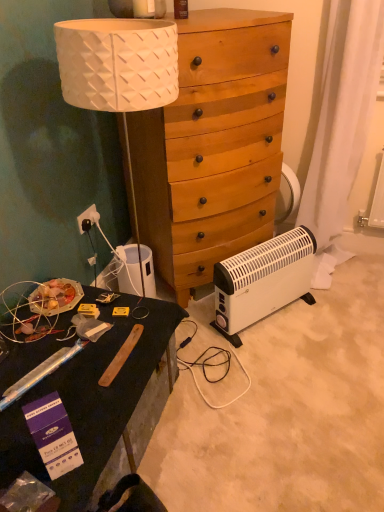
Describe the element at coordinates (85, 217) in the screenshot. This screenshot has width=384, height=512. I see `white plastic power outlet at lower left` at that location.

The height and width of the screenshot is (512, 384). What do you see at coordinates (262, 280) in the screenshot?
I see `white plastic radiator at lower right` at bounding box center [262, 280].

In order to face translucent plastic bottle at upper center, should I rotate leftwards or rightwards?

It's best to rotate left around 1.697 degrees.

Identify the location of white plastic power outlet at lower left. This screenshot has height=512, width=384. (85, 217).

Does point (181, 17) come behind point (82, 219)?

No, it is in front of (82, 219).

Is translucent plastic bottle at upper center smaller than white plastic power outlet at lower left?

Indeed, translucent plastic bottle at upper center has a smaller size compared to white plastic power outlet at lower left.

Is translucent plastic bottle at upper center spatially inside white plastic power outlet at lower left, or outside of it?

translucent plastic bottle at upper center lies outside white plastic power outlet at lower left.

Image resolution: width=384 pixels, height=512 pixels. I want to click on desk in front of the white plastic radiator at lower right, so click(92, 400).

Relative to black matte desk at lower left, is white plastic radiator at lower right in front or behind?

white plastic radiator at lower right is positioned farther from the viewer than black matte desk at lower left.

Considering the sizes of objects white plastic radiator at lower right and black matte desk at lower left in the image provided, who is wider, white plastic radiator at lower right or black matte desk at lower left?

Wider between the two is black matte desk at lower left.

Is point (230, 307) closer to viewer compared to point (59, 373)?

No.

Considering the relative sizes of white plastic power outlet at lower left and wooden dresser at center in the image provided, is white plastic power outlet at lower left smaller than wooden dresser at center?

Indeed, white plastic power outlet at lower left has a smaller size compared to wooden dresser at center.

Is wooden dresser at center located within white plastic power outlet at lower left?

No, white plastic power outlet at lower left does not contain wooden dresser at center.

Find the location of `dresser above the white plastic power outlet at lower left (from a real-world perspective)`. dresser above the white plastic power outlet at lower left (from a real-world perspective) is located at coordinates (213, 145).

Is white plastic power outlet at lower left at the back of black matte desk at lower left?

That's not correct — black matte desk at lower left is not looking away from white plastic power outlet at lower left.

Image resolution: width=384 pixels, height=512 pixels. Find the location of `power outlet behind the black matte desk at lower left`. power outlet behind the black matte desk at lower left is located at coordinates (85, 217).

Can you confirm if black matte desk at lower left is smaller than white plastic power outlet at lower left?

No, black matte desk at lower left is not smaller than white plastic power outlet at lower left.

Considering the relative sizes of wooden dresser at center and white plastic radiator at lower right in the image provided, is wooden dresser at center wider than white plastic radiator at lower right?

Correct, the width of wooden dresser at center exceeds that of white plastic radiator at lower right.

Is wooden dresser at center not within white plastic radiator at lower right?

wooden dresser at center is positioned outside white plastic radiator at lower right.

Which is more to the right, wooden dresser at center or white plastic radiator at lower right?

Positioned to the right is white plastic radiator at lower right.

From the picture: From a real-world perspective, which object rests below the other?

In real-world perspective, white plastic radiator at lower right is lower.

Is translucent plastic bottle at upper center positioned with its back to purple cardboard box at lower left?

No.

Is translucent plastic bottle at upper center inside the boundaries of purple cardboard box at lower left, or outside?

translucent plastic bottle at upper center lies outside purple cardboard box at lower left.

Looking at this image, in terms of size, does translucent plastic bottle at upper center appear bigger or smaller than purple cardboard box at lower left?

translucent plastic bottle at upper center is smaller than purple cardboard box at lower left.

Between translucent plastic bottle at upper center and purple cardboard box at lower left, which one is positioned behind?

Positioned behind is translucent plastic bottle at upper center.

Can you confirm if wooden dresser at center is bigger than white plastic power outlet at lower left?

Correct, wooden dresser at center is larger in size than white plastic power outlet at lower left.

From a real-world perspective, is wooden dresser at center positioned above or below white plastic power outlet at lower left?

From a real-world perspective, wooden dresser at center is physically above white plastic power outlet at lower left.

The width and height of the screenshot is (384, 512). I want to click on power outlet on the left of wooden dresser at center, so click(85, 217).

You are a GUI agent. You are given a task and a screenshot of the screen. Output one action in this format:
    pyautogui.click(x=<x>, y=<y>)
    Task: Click on the power outlet beneath the translucent plastic bottle at upper center (from a real-world perspective)
    Image resolution: width=384 pixels, height=512 pixels.
    Given the screenshot: What is the action you would take?
    pyautogui.click(x=85, y=217)

The height and width of the screenshot is (512, 384). What are the coordinates of `radiator behind the black matte desk at lower left` in the screenshot? It's located at (262, 280).

Based on their spatial positions, is wooden dresser at center or translucent plastic bottle at upper center closer to white plastic radiator at lower right?

wooden dresser at center lies closer to white plastic radiator at lower right than the other object.

Estimate the real-world distances between objects in this image. Which object is further from black matte desk at lower left, translucent plastic bottle at upper center or white plastic radiator at lower right?

translucent plastic bottle at upper center is positioned further to the anchor black matte desk at lower left.

Which object lies nearer to the anchor point wooden dresser at center, white plastic power outlet at lower left or purple cardboard box at lower left?

white plastic power outlet at lower left.

Estimate the real-world distances between objects in this image. Which object is closer to white plastic power outlet at lower left, purple cardboard box at lower left or white plastic radiator at lower right?

white plastic radiator at lower right is positioned closer to the anchor white plastic power outlet at lower left.

When comparing their distances from wooden dresser at center, does white plastic radiator at lower right or translucent plastic bottle at upper center seem closer?

white plastic radiator at lower right lies closer to wooden dresser at center than the other object.

Based on their spatial positions, is wooden dresser at center or purple cardboard box at lower left further from white plastic power outlet at lower left?

Based on the image, purple cardboard box at lower left appears to be further to white plastic power outlet at lower left.

From the image, which object appears to be farther from wooden dresser at center, black matte desk at lower left or white plastic power outlet at lower left?

black matte desk at lower left lies further to wooden dresser at center than the other object.

From the image, which object appears to be farther from white plastic radiator at lower right, black matte desk at lower left or white plastic power outlet at lower left?

white plastic power outlet at lower left is further to white plastic radiator at lower right.

Locate an element on the screen. The image size is (384, 512). desk between purple cardboard box at lower left and white plastic power outlet at lower left along the z-axis is located at coordinates (92, 400).

Identify the location of radiator between black matte desk at lower left and white plastic power outlet at lower left in the front-back direction. The image size is (384, 512). (262, 280).

You are a GUI agent. You are given a task and a screenshot of the screen. Output one action in this format:
    pyautogui.click(x=<x>, y=<y>)
    Task: Click on the dresser positioned between purple cardboard box at lower left and white plastic power outlet at lower left from near to far
    This screenshot has width=384, height=512.
    Given the screenshot: What is the action you would take?
    pyautogui.click(x=213, y=145)

Find the location of `radiator between purple cardboard box at lower left and white plastic power outlet at lower left from front to back`. radiator between purple cardboard box at lower left and white plastic power outlet at lower left from front to back is located at coordinates pyautogui.click(x=262, y=280).